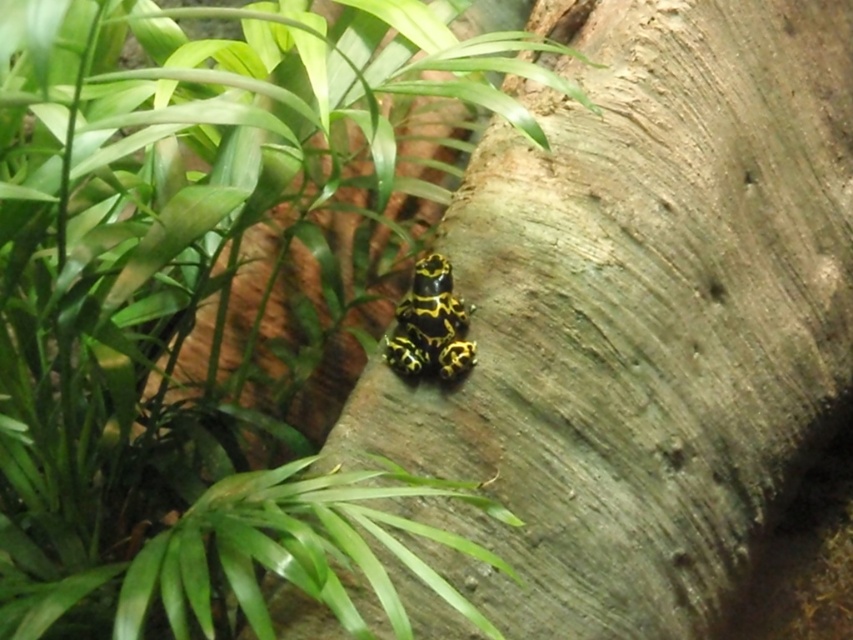
You are a botanist studying the positioning of plants in a forest. You observe a green leafy plant at center at point (207, 298). Can you confirm if this point is the center of the image?

The green leafy plant at center is located at point (207, 298), which corresponds to the center of the image.

You are a gardener who needs to water both the green leafy plant at center and the smooth brown tree trunk at center. The watering can you have can only reach 40 centimeters. Can you water both objects without moving the watering can?

The green leafy plant at center is 44.39 centimeters away from the smooth brown tree trunk at center. Since the watering can can only reach 40 centimeters, you cannot water both objects without moving the watering can because the distance between them exceeds the can reach.